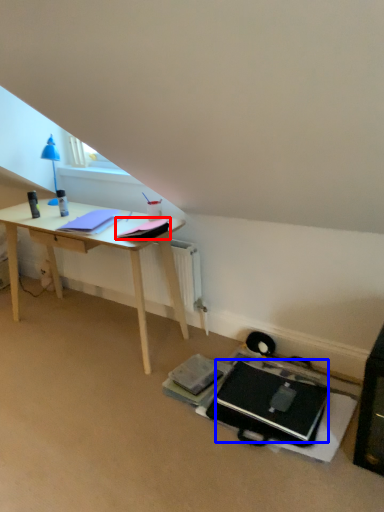
Question: Which of the following is the farthest to the observer, notepad (highlighted by a red box) or laptop (highlighted by a blue box)?

Choices:
 (A) notepad
 (B) laptop

Answer: (A)